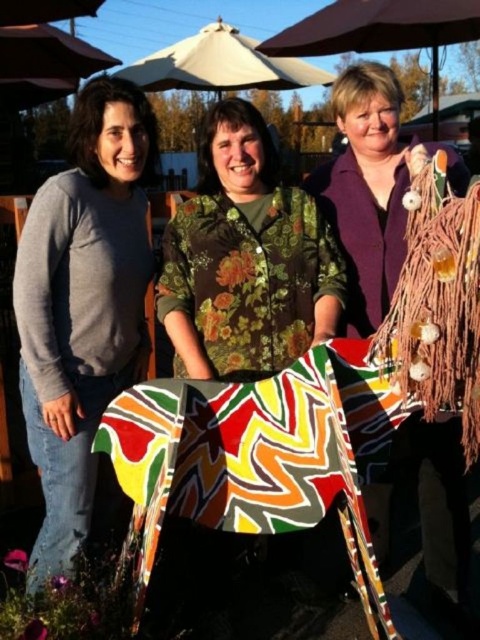
Who is positioned more to the right, matte white umbrella at upper center or beige fabric umbrella at upper center?

Positioned to the right is matte white umbrella at upper center.

Which is in front, point (437, 29) or point (300, 70)?

Point (437, 29) is in front.

Is point (437, 4) closer to viewer compared to point (120, 74)?

Yes, it is in front of point (120, 74).

The height and width of the screenshot is (640, 480). In order to click on matte white umbrella at upper center in this screenshot , I will do `click(381, 29)`.

This screenshot has width=480, height=640. What do you see at coordinates (372, 188) in the screenshot?
I see `purple woolen sweater at center` at bounding box center [372, 188].

Is point (383, 536) farther from viewer compared to point (427, 44)?

No, it is in front of (427, 44).

Measure the distance between purple woolen sweater at center and camera.

purple woolen sweater at center and camera are 1.97 meters apart.

The image size is (480, 640). I want to click on purple woolen sweater at center, so click(x=372, y=188).

Who is more forward, (108, 344) or (382, 12)?

Point (108, 344)

Locate an element on the screen. matte gray sweater at left is located at coordinates (83, 305).